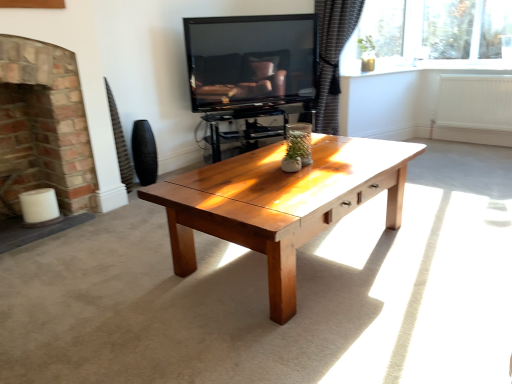
Question: Does white painted radiator at right have a greater width compared to brick fireplace at left?

Choices:
 (A) no
 (B) yes

Answer: (A)

Question: Is white painted radiator at right positioned with its back to brick fireplace at left?

Choices:
 (A) no
 (B) yes

Answer: (A)

Question: Does white painted radiator at right have a greater height compared to brick fireplace at left?

Choices:
 (A) no
 (B) yes

Answer: (A)

Question: From a real-world perspective, is white painted radiator at right physically below brick fireplace at left?

Choices:
 (A) yes
 (B) no

Answer: (A)

Question: Is white painted radiator at right located outside brick fireplace at left?

Choices:
 (A) yes
 (B) no

Answer: (A)

Question: Is white painted radiator at right oriented towards brick fireplace at left?

Choices:
 (A) no
 (B) yes

Answer: (B)

Question: Can you confirm if matte black tv at upper center is wider than dark textured curtain at upper right?

Choices:
 (A) no
 (B) yes

Answer: (A)

Question: Is matte black tv at upper center positioned before dark textured curtain at upper right?

Choices:
 (A) yes
 (B) no

Answer: (A)

Question: From a real-world perspective, is matte black tv at upper center on dark textured curtain at upper right?

Choices:
 (A) no
 (B) yes

Answer: (B)

Question: Would you say matte black tv at upper center contains dark textured curtain at upper right?

Choices:
 (A) no
 (B) yes

Answer: (A)

Question: Would you say matte black tv at upper center is outside dark textured curtain at upper right?

Choices:
 (A) no
 (B) yes

Answer: (B)

Question: Does matte black tv at upper center have a lesser width compared to dark textured curtain at upper right?

Choices:
 (A) yes
 (B) no

Answer: (A)

Question: Can you confirm if matte black tv at upper center is bigger than black matte vase at left?

Choices:
 (A) no
 (B) yes

Answer: (B)